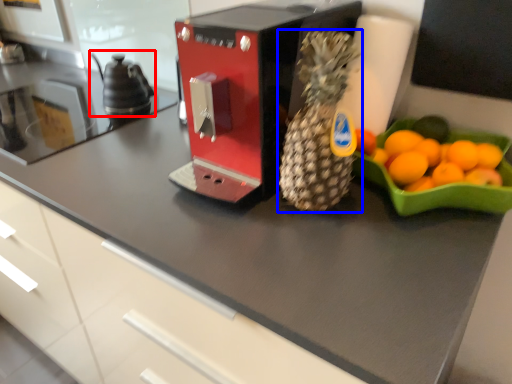
Question: Which point is closer to the camera, tea pot (highlighted by a red box) or pineapple (highlighted by a blue box)?

Choices:
 (A) tea pot
 (B) pineapple

Answer: (B)